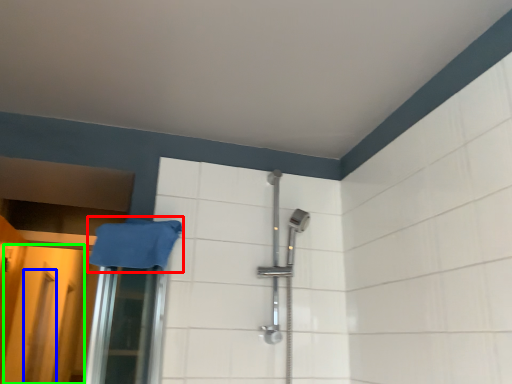
Question: Which object is positioned closest to bath towel (highlighted by a red box)? Select from screen door (highlighted by a blue box) and screen door (highlighted by a green box).

Choices:
 (A) screen door
 (B) screen door

Answer: (B)